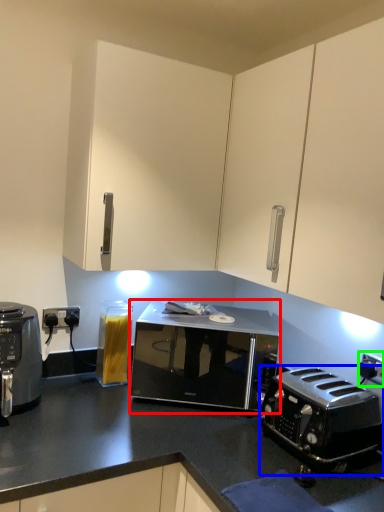
Question: Based on their relative distances, which object is nearer to microwave oven (highlighted by a red box)? Choose from toaster (highlighted by a blue box) and electric outlet (highlighted by a green box).

Choices:
 (A) toaster
 (B) electric outlet

Answer: (A)